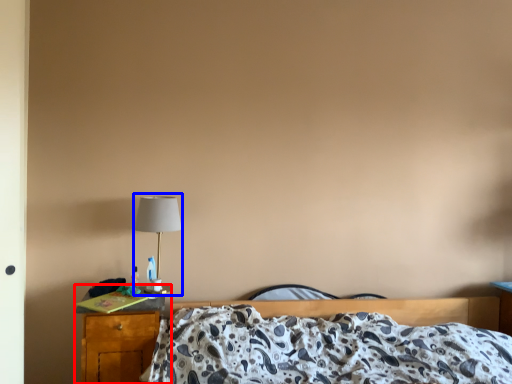
Question: Which point is further to the camera, nightstand (highlighted by a red box) or table lamp (highlighted by a blue box)?

Choices:
 (A) nightstand
 (B) table lamp

Answer: (B)